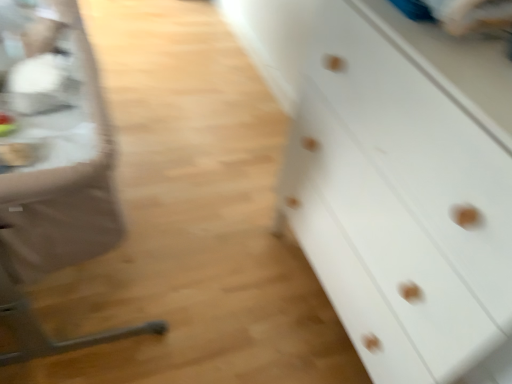
The image size is (512, 384). I want to click on spots to the right of metallic silver feeding chair at left, so click(217, 254).